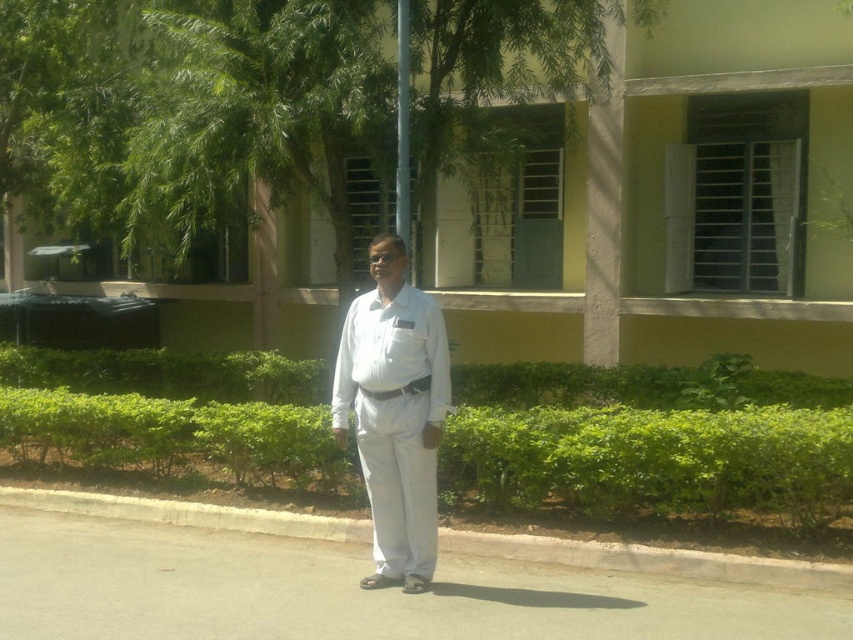
Is green leafy hedge at center bigger than white cotton shirt at center?

No.

Does green leafy hedge at center come in front of white cotton shirt at center?

No, green leafy hedge at center is further to the viewer.

The width and height of the screenshot is (853, 640). What do you see at coordinates (650, 442) in the screenshot? I see `green leafy hedge at center` at bounding box center [650, 442].

Where is `green leafy hedge at center`? The height and width of the screenshot is (640, 853). green leafy hedge at center is located at coordinates (650, 442).

Looking at this image, which is more to the left, green leafy hedge at center or gray concrete curb at lower center?

gray concrete curb at lower center is more to the left.

Who is more forward, (x=686, y=508) or (x=821, y=580)?

Point (x=821, y=580)

Locate an element on the screen. The width and height of the screenshot is (853, 640). green leafy hedge at center is located at coordinates (650, 442).

Does white cotton shirt at center have a greater width compared to gray concrete curb at lower center?

No.

Does point (425, 458) come behind point (521, 540)?

No, it is in front of (521, 540).

This screenshot has height=640, width=853. What do you see at coordinates (393, 413) in the screenshot?
I see `white cotton shirt at center` at bounding box center [393, 413].

I want to click on white cotton shirt at center, so click(x=393, y=413).